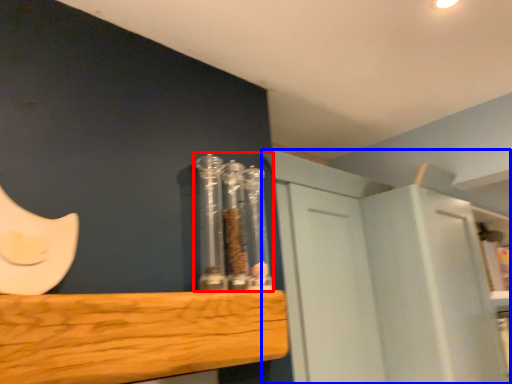
Question: Which object is further to the camera taking this photo, glass jar (highlighted by a red box) or cabinetry (highlighted by a blue box)?

Choices:
 (A) glass jar
 (B) cabinetry

Answer: (B)